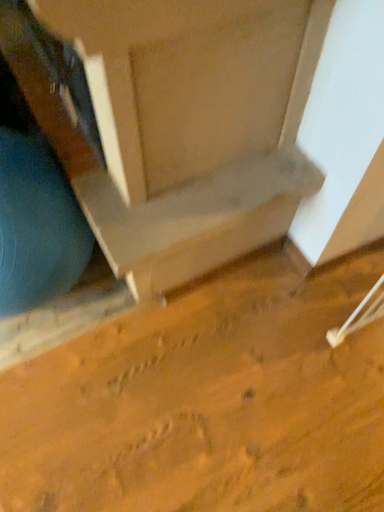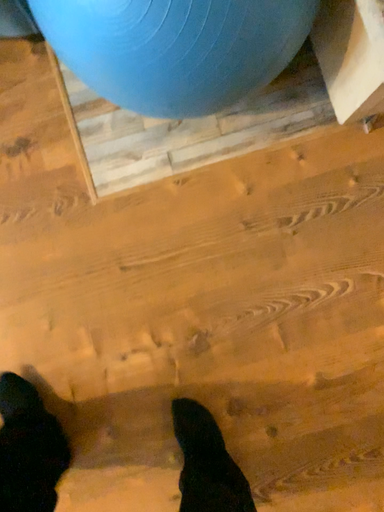
Question: How did the camera likely rotate when shooting the video?

Choices:
 (A) rotated downward
 (B) rotated upward

Answer: (A)